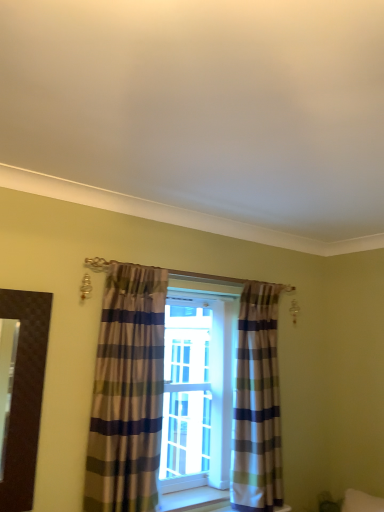
Question: Does striped fabric curtain at center, acting as the 1th curtain starting from the back, have a greater width compared to striped fabric curtain at center, the second curtain in the back-to-front sequence?

Choices:
 (A) yes
 (B) no

Answer: (A)

Question: Is striped fabric curtain at center, which appears as the second curtain when viewed from the left, not inside striped fabric curtain at center, which is the 1th curtain from front to back?

Choices:
 (A) yes
 (B) no

Answer: (A)

Question: From the image's perspective, does striped fabric curtain at center, which appears as the second curtain when viewed from the left, appear lower than striped fabric curtain at center, arranged as the first curtain when viewed from the left?

Choices:
 (A) yes
 (B) no

Answer: (A)

Question: Is striped fabric curtain at center, which is the 1th curtain from front to back, surrounded by striped fabric curtain at center, which appears as the second curtain when viewed from the left?

Choices:
 (A) yes
 (B) no

Answer: (B)

Question: From the image's perspective, is striped fabric curtain at center, which appears as the second curtain when viewed from the left, located above striped fabric curtain at center, the second curtain in the back-to-front sequence?

Choices:
 (A) yes
 (B) no

Answer: (B)

Question: From a real-world perspective, is striped fabric curtain at center, which appears as the second curtain when viewed from the left, physically above striped fabric curtain at center, marked as the 2th curtain in a right-to-left arrangement?

Choices:
 (A) no
 (B) yes

Answer: (A)

Question: Is striped fabric curtain at center, arranged as the first curtain when viewed from the left, turned away from striped fabric curtain at center, the 2th curtain viewed from the front?

Choices:
 (A) no
 (B) yes

Answer: (A)

Question: From a real-world perspective, is striped fabric curtain at center, which is the 1th curtain from front to back, over striped fabric curtain at center, the 2th curtain viewed from the front?

Choices:
 (A) yes
 (B) no

Answer: (A)

Question: Can you confirm if striped fabric curtain at center, which is the 1th curtain from front to back, is shorter than striped fabric curtain at center, acting as the 1th curtain starting from the back?

Choices:
 (A) yes
 (B) no

Answer: (A)

Question: Considering the relative sizes of striped fabric curtain at center, the second curtain in the back-to-front sequence, and striped fabric curtain at center, the 1th curtain viewed from the right, in the image provided, is striped fabric curtain at center, the second curtain in the back-to-front sequence, smaller than striped fabric curtain at center, the 1th curtain viewed from the right,?

Choices:
 (A) no
 (B) yes

Answer: (B)

Question: Can you confirm if striped fabric curtain at center, which is the 1th curtain from front to back, is positioned to the left of striped fabric curtain at center, the 2th curtain viewed from the front?

Choices:
 (A) no
 (B) yes

Answer: (B)

Question: From the image's perspective, is striped fabric curtain at center, which is the 1th curtain from front to back, located beneath striped fabric curtain at center, which appears as the second curtain when viewed from the left?

Choices:
 (A) no
 (B) yes

Answer: (A)

Question: Which is correct: striped fabric curtain at center, acting as the 1th curtain starting from the back, is inside striped fabric curtain at center, marked as the 2th curtain in a right-to-left arrangement, or outside of it?

Choices:
 (A) inside
 (B) outside

Answer: (B)